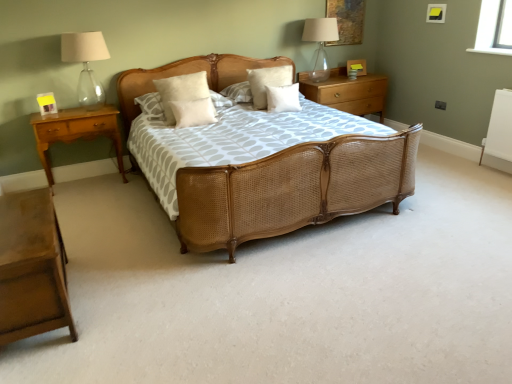
Where is `vacant space underneath clear glass table lamp at upper left, which is the second table lamp in back-to-front order (from a real-world perspective)`? The width and height of the screenshot is (512, 384). vacant space underneath clear glass table lamp at upper left, which is the second table lamp in back-to-front order (from a real-world perspective) is located at coordinates pyautogui.click(x=93, y=108).